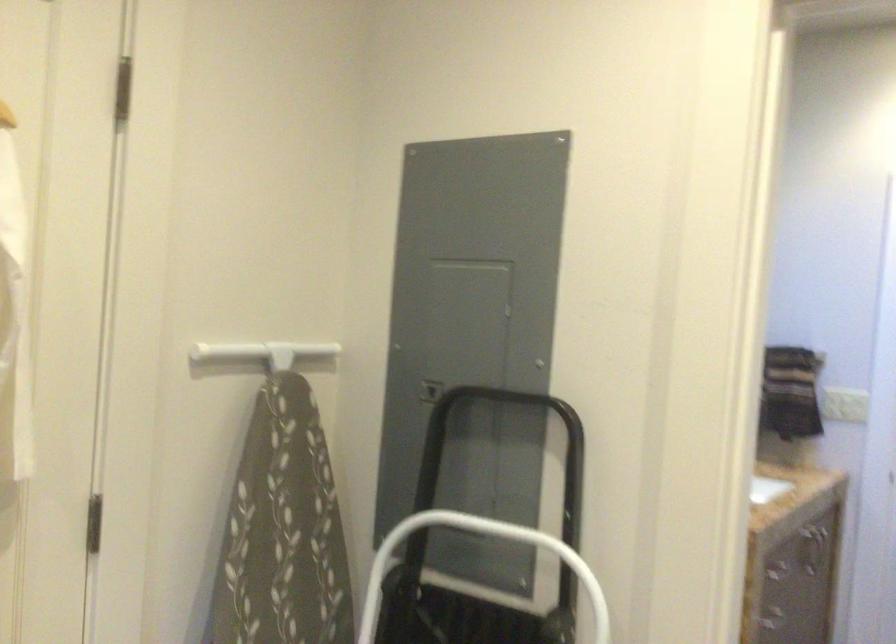
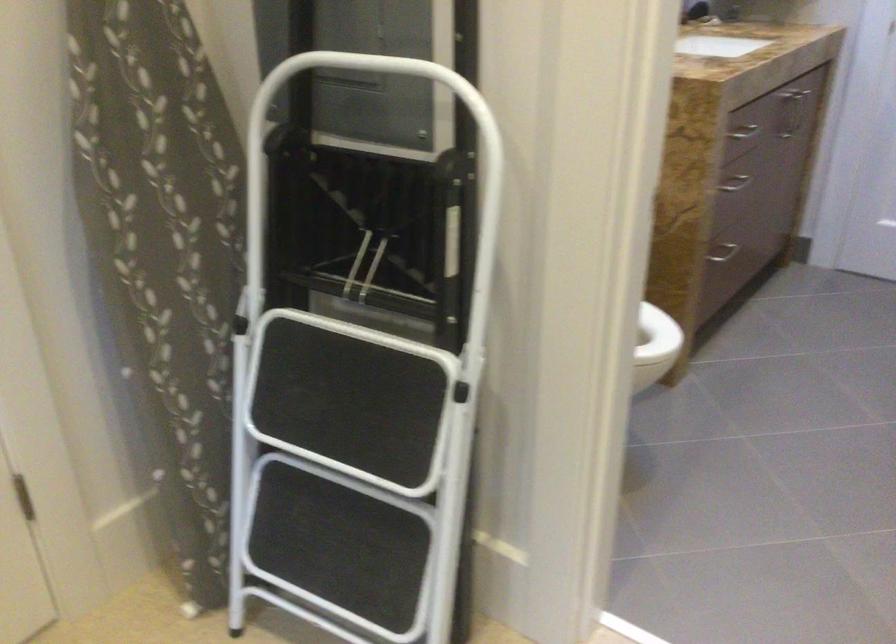
Question: Based on the continuous images, in which direction is the camera rotating? Reply with the corresponding letter.

Choices:
 (A) Left
 (B) Right
 (C) Up
 (D) Down

Answer: (D)